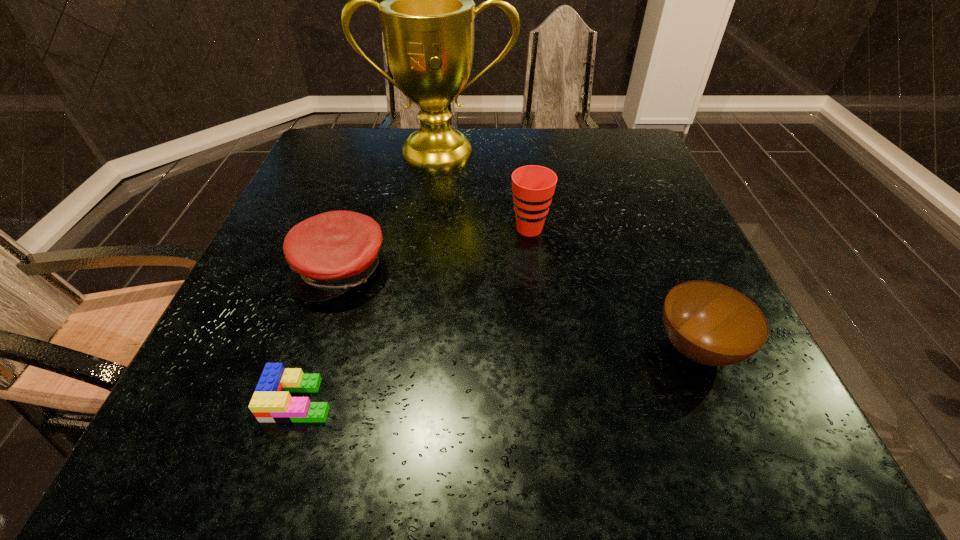
Identify the location of vacant space positioned on the right of the Lego. (408, 400).

Locate an element on the screen. This screenshot has width=960, height=540. object located at the far edge is located at coordinates (427, 16).

Where is `object present at the near edge`? Image resolution: width=960 pixels, height=540 pixels. object present at the near edge is located at coordinates (271, 402).

Locate an element on the screen. award situated at the left edge is located at coordinates (427, 16).

Image resolution: width=960 pixels, height=540 pixels. Find the location of `cap present at the left edge`. cap present at the left edge is located at coordinates (330, 253).

At what (x,y) coordinates should I click in order to perform the action: click on Lego located at the left edge. Please return your answer as a coordinate pair (x, y). The width and height of the screenshot is (960, 540). Looking at the image, I should click on (271, 402).

Locate an element on the screen. object at the right edge is located at coordinates (709, 323).

The image size is (960, 540). In order to click on object at the far left corner in this screenshot , I will do `click(427, 16)`.

Find the location of `object present at the near left corner`. object present at the near left corner is located at coordinates tap(271, 402).

Find the location of a particular element. Image resolution: width=960 pixels, height=540 pixels. blank area at the far edge is located at coordinates (546, 160).